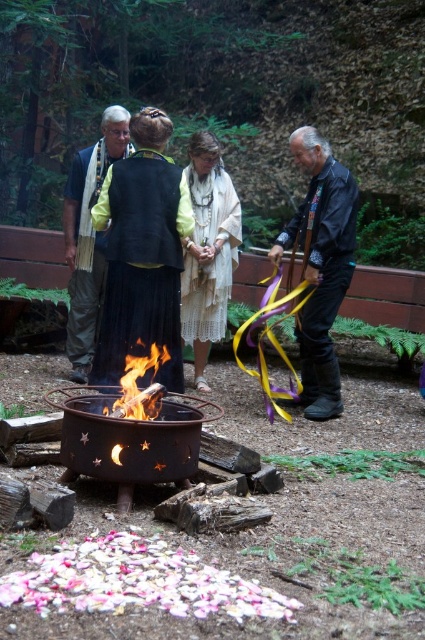
You are an outdoor enthusiast planning to sit near the fire pit. You have the black leather jacket at right and the dark blue scarf at center. Which item is smaller in size?

The black leather jacket at right has a smaller size compared to the dark blue scarf at center, so the black leather jacket at right is smaller.

You are standing at the fire pit in the forest scene. There are two points marked in the image. Which point is closer to you, point (161, 118) or point (78, 349)?

Point (161, 118) is in front of point (78, 349), so it is closer to you.

You are standing near the fire pit and need to grab both the black velvet vest at center and the dark blue scarf at center. Can you reach both items without moving your feet?

The black velvet vest at center is 1.01 meters away from the dark blue scarf at center. Since the distance between them is over a meter, you would need to move your feet to reach both items.